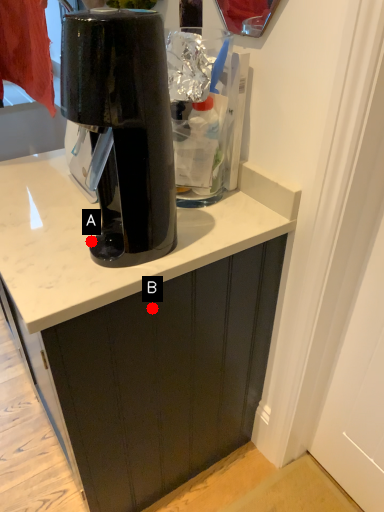
Question: Two points are circled on the image, labeled by A and B beside each circle. Which point appears farthest from the camera in this image?

Choices:
 (A) A is further
 (B) B is further

Answer: (B)